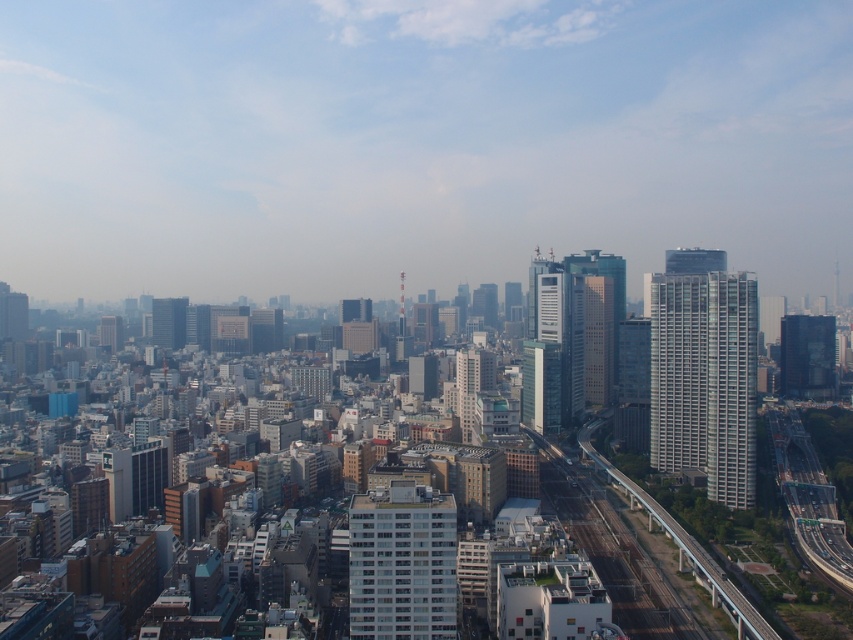
What do you see at coordinates (703, 371) in the screenshot?
I see `white glass building at right` at bounding box center [703, 371].

Does white glass building at right appear under dark glass skyscraper at right?

Incorrect, white glass building at right is not positioned below dark glass skyscraper at right.

Identify the location of white glass building at right. (703, 371).

Does white glass building at right have a larger size compared to white smooth building at center?

Yes, white glass building at right is bigger than white smooth building at center.

The image size is (853, 640). What do you see at coordinates (703, 371) in the screenshot? I see `white glass building at right` at bounding box center [703, 371].

Who is more forward, (695, 392) or (364, 547)?

Point (364, 547) is in front.

Image resolution: width=853 pixels, height=640 pixels. I want to click on white glass building at right, so click(703, 371).

This screenshot has height=640, width=853. Describe the element at coordinates (402, 563) in the screenshot. I see `white smooth building at center` at that location.

Can you confirm if white smooth building at center is smaller than matte glass skyscraper at left?

Actually, white smooth building at center might be larger than matte glass skyscraper at left.

Which is in front, point (404, 632) or point (166, 324)?

Point (404, 632) is in front.

Where is `white smooth building at center`? The height and width of the screenshot is (640, 853). white smooth building at center is located at coordinates (402, 563).